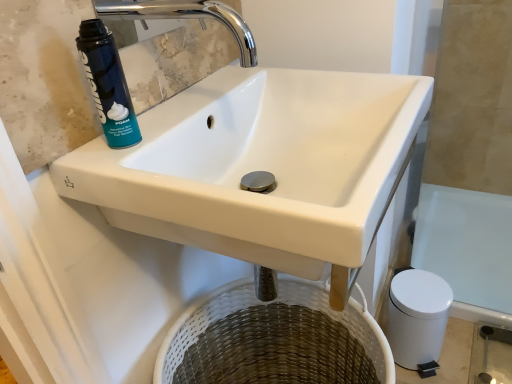
In order to click on free spot below chrome metallic faucet at upper center (from a real-world perspective) in this screenshot , I will do `click(189, 105)`.